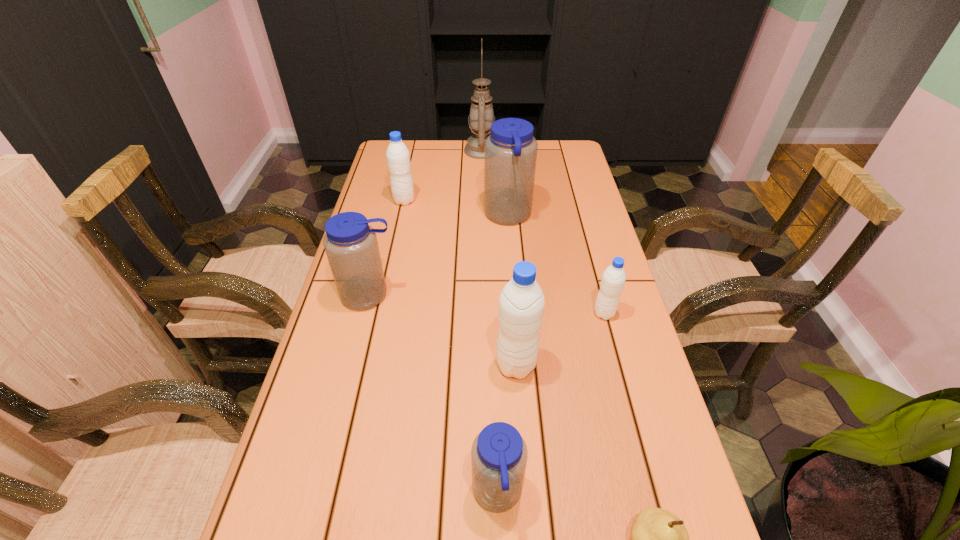
This screenshot has height=540, width=960. Identify the location of the rightmost water bottle. (613, 279).

What are the coordinates of `the nearest blue water bottle` in the screenshot? It's located at (499, 454).

Where is `the smallest blue water bottle`? The height and width of the screenshot is (540, 960). the smallest blue water bottle is located at coordinates (499, 454).

Find the location of a particular element. The height and width of the screenshot is (540, 960). blank space located 0.150m on the right of the farthest object is located at coordinates (538, 151).

The width and height of the screenshot is (960, 540). What are the coordinates of `free space located on the left of the biggest gray water bottle` in the screenshot? It's located at (412, 365).

I want to click on vacant region located with a carrying loop on the side of the biggest blue water bottle, so click(419, 216).

Where is `vacant space located with a carrying loop on the side of the biggest blue water bottle`? Image resolution: width=960 pixels, height=540 pixels. vacant space located with a carrying loop on the side of the biggest blue water bottle is located at coordinates (381, 216).

You are a GUI agent. You are given a task and a screenshot of the screen. Output one action in this format:
    pyautogui.click(x=<x>, y=<y>)
    Task: Click on the free location located with a carrying loop on the side of the biggest blue water bottle
    Image resolution: width=960 pixels, height=540 pixels.
    Given the screenshot: What is the action you would take?
    pyautogui.click(x=428, y=216)

In order to click on vacant point located 0.350m on the back of the leftmost gray water bottle in this screenshot , I will do `click(417, 145)`.

Where is `vacant space located with a carrying loop on the side of the leftmost blue water bottle`? vacant space located with a carrying loop on the side of the leftmost blue water bottle is located at coordinates (339, 418).